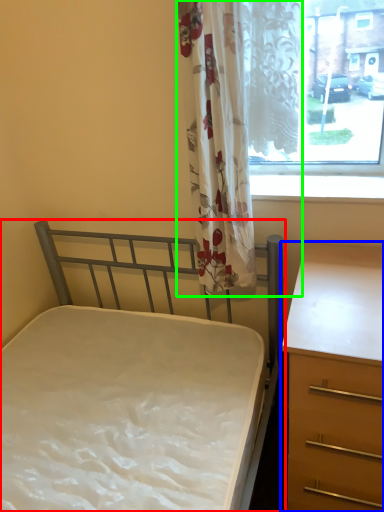
Question: Which is nearer to the bed (highlighted by a red box)? chest of drawers (highlighted by a blue box) or curtain (highlighted by a green box).

Choices:
 (A) chest of drawers
 (B) curtain

Answer: (A)